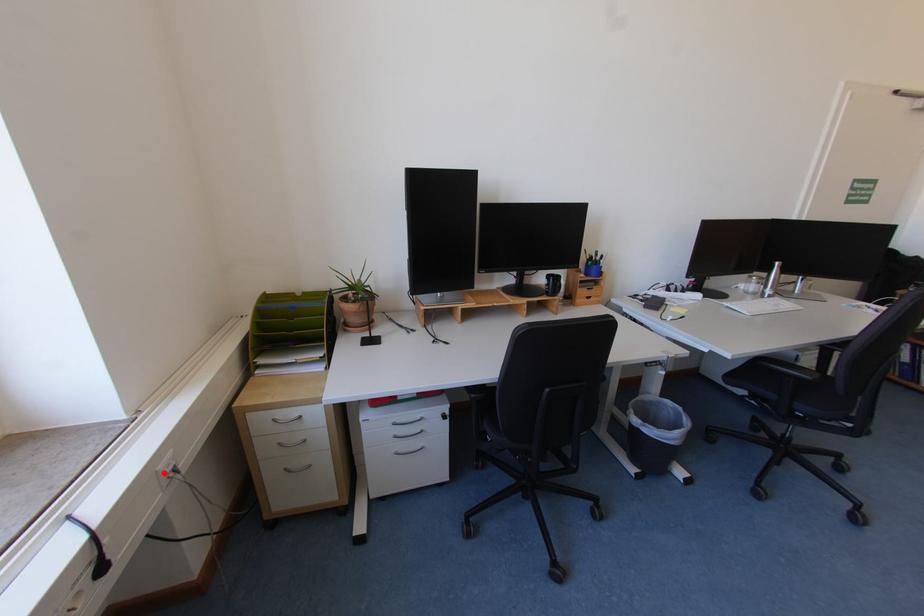
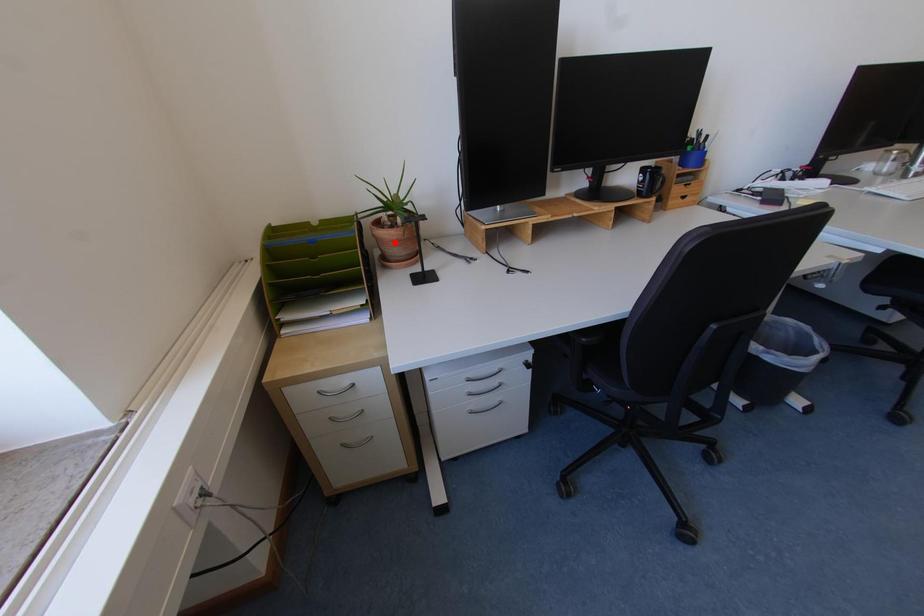
I am providing you with two images of the same scene from different viewpoints. A red point is marked on the first image and another point is marked on the second image. Do the highlighted points in image1 and image2 indicate the same real-world spot?

No